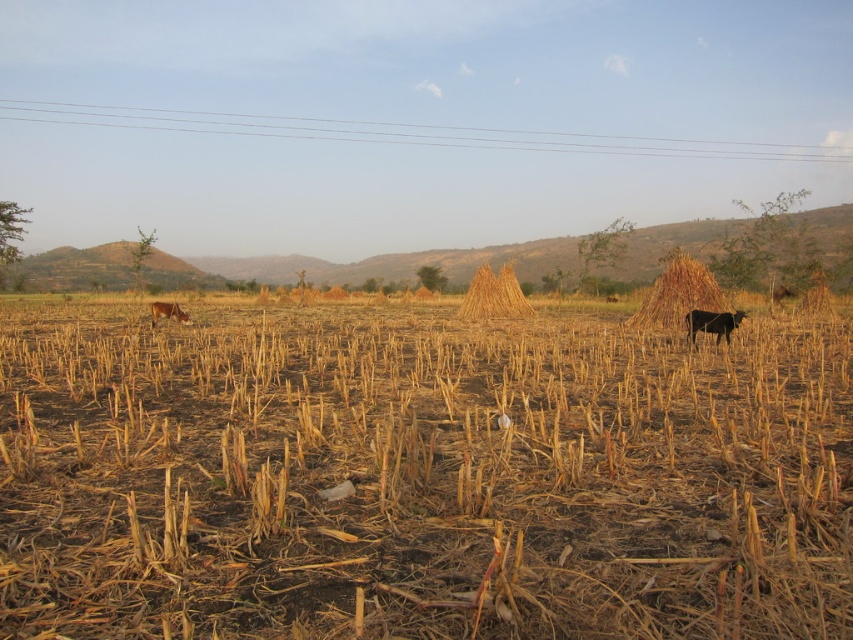
Question: Which object is closer to the camera taking this photo?

Choices:
 (A) braided straw stack at center
 (B) brown dry grass at center
 (C) black glossy cow at right

Answer: (B)

Question: Which point is closer to the camera taking this photo?

Choices:
 (A) (479, 285)
 (B) (717, 336)
 (C) (677, 273)
 (D) (65, 429)

Answer: (D)

Question: Estimate the real-world distances between objects in this image. Which object is closer to the brown fur dog at lower left?

Choices:
 (A) braided straw stack at center
 (B) brown straw stack at right
 (C) brown dry grass at center
 (D) black glossy cow at right

Answer: (C)

Question: Is brown dry grass at center thinner than braided straw stack at center?

Choices:
 (A) no
 (B) yes

Answer: (A)

Question: Where is brown straw stack at right located in relation to black glossy cow at right in the image?

Choices:
 (A) right
 (B) left

Answer: (A)

Question: Is brown dry grass at center behind black glossy cow at right?

Choices:
 (A) yes
 (B) no

Answer: (B)